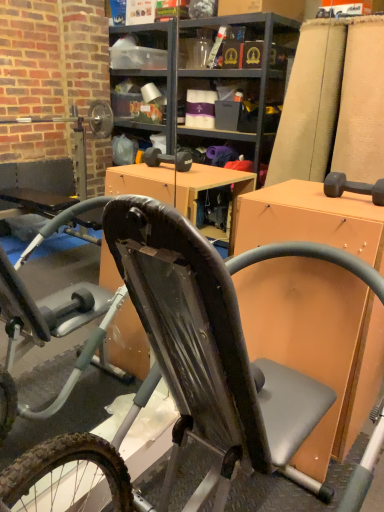
Question: Visually, is black rubber bicycle at center positioned to the left or to the right of orange matte desk at center?

Choices:
 (A) left
 (B) right

Answer: (A)

Question: In terms of size, does black rubber bicycle at center appear bigger or smaller than orange matte desk at center?

Choices:
 (A) big
 (B) small

Answer: (A)

Question: Is black rubber bicycle at center inside or outside of orange matte desk at center?

Choices:
 (A) inside
 (B) outside

Answer: (B)

Question: From a real-world perspective, is orange matte desk at center above or below black rubber bicycle at center?

Choices:
 (A) below
 (B) above

Answer: (A)

Question: Is point (362, 208) positioned closer to the camera than point (125, 239)?

Choices:
 (A) farther
 (B) closer

Answer: (A)

Question: In terms of height, does orange matte desk at center look taller or shorter compared to black rubber bicycle at center?

Choices:
 (A) tall
 (B) short

Answer: (B)

Question: Would you say orange matte desk at center is inside or outside black rubber bicycle at center?

Choices:
 (A) outside
 (B) inside

Answer: (A)